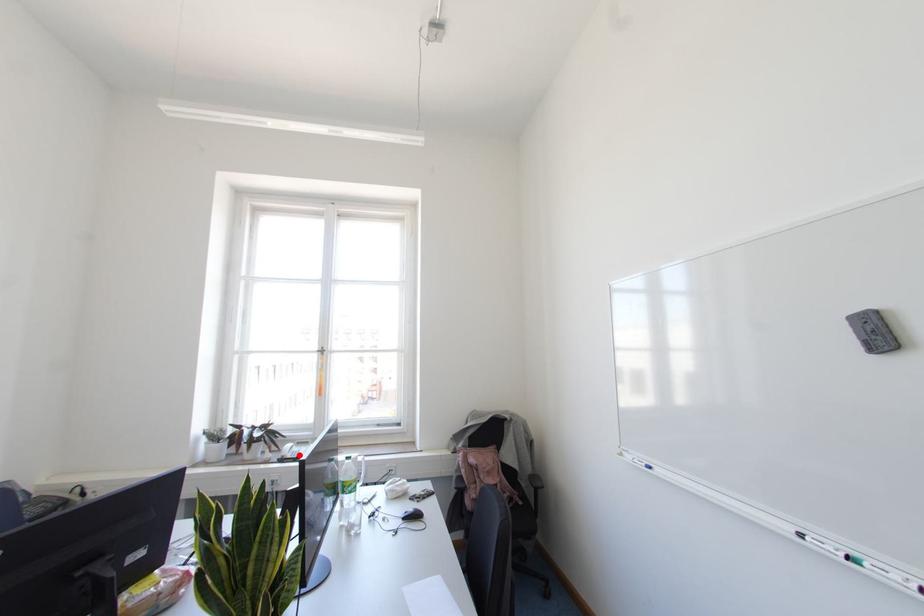
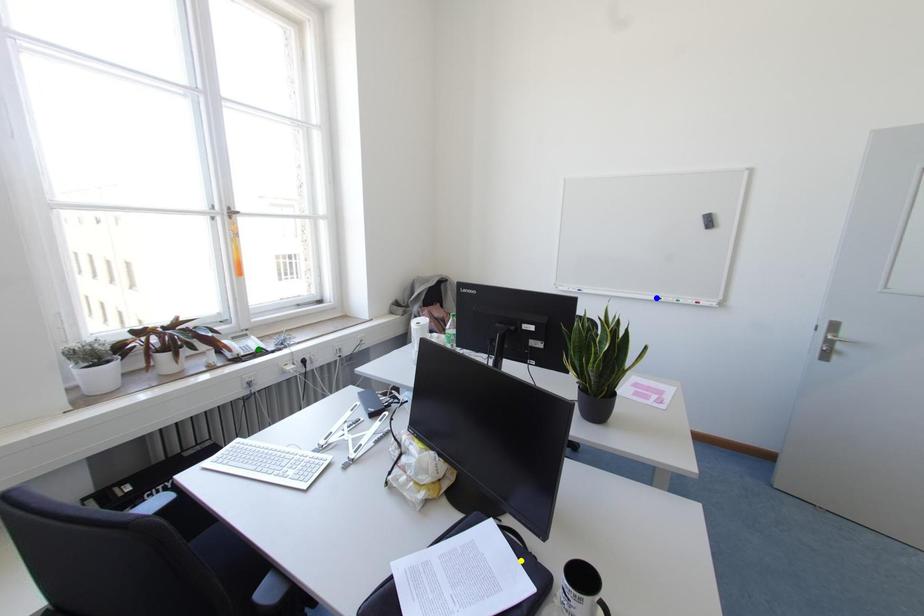
Question: I am providing you with two images of the same scene from different viewpoints. A red point is marked on the first image. You are given multiple points on the second image. Which point in image 2 is actually the same real-world point as the red point in image 1?

Choices:
 (A) green point
 (B) blue point
 (C) yellow point

Answer: (A)